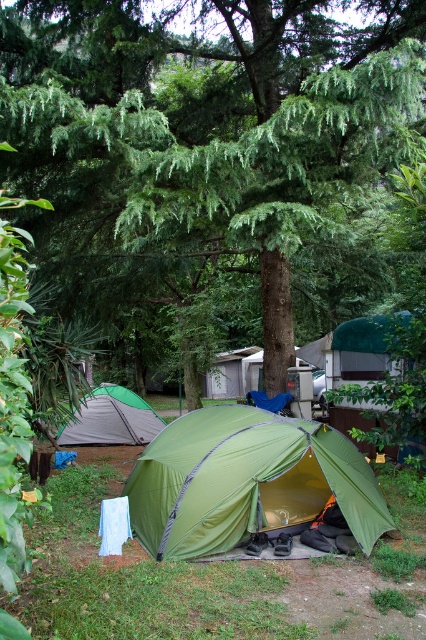
Looking at this image, is green leafy tree at center smaller than green fabric tent at center?

Correct, green leafy tree at center occupies less space than green fabric tent at center.

Does point (100, 24) come in front of point (302, 472)?

No, (100, 24) is behind (302, 472).

Which is behind, point (236, 61) or point (221, 413)?

The point (236, 61) is behind.

You are a GUI agent. You are given a task and a screenshot of the screen. Output one action in this format:
    pyautogui.click(x=<x>, y=<y>)
    Task: Click on the green leafy tree at center
    
    Given the screenshot: What is the action you would take?
    pyautogui.click(x=213, y=125)

Can you confirm if green fabric tent at center is taller than green fabric tent at lower left?

Indeed, green fabric tent at center has a greater height compared to green fabric tent at lower left.

At what (x,y) coordinates should I click in order to perform the action: click on green fabric tent at center. Please return your answer as a coordinate pair (x, y). The height and width of the screenshot is (640, 426). Looking at the image, I should click on (247, 481).

From the picture: Can you confirm if green leafy tree at center is wider than green fabric tent at lower left?

No, green leafy tree at center is not wider than green fabric tent at lower left.

Between green leafy tree at center and green fabric tent at lower left, which one appears on the right side from the viewer's perspective?

Positioned to the right is green leafy tree at center.

Is point (72, 131) in front of point (104, 435)?

Yes, it is in front of point (104, 435).

At what (x,y) coordinates should I click in order to perform the action: click on green leafy tree at center. Please return your answer as a coordinate pair (x, y). Image resolution: width=426 pixels, height=640 pixels. Looking at the image, I should click on (213, 125).